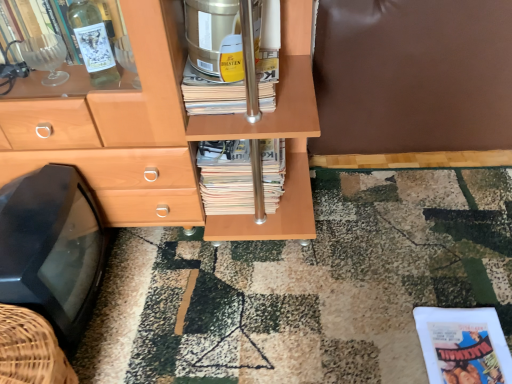
This screenshot has width=512, height=384. What are the coordinates of `black plastic tv at lower left` in the screenshot? It's located at (52, 248).

The width and height of the screenshot is (512, 384). What are the coordinates of `gold metallic canister at center` in the screenshot? It's located at (211, 94).

Identify the location of matte white paperback book at lower right. (463, 345).

This screenshot has width=512, height=384. What do you see at coordinates (463, 345) in the screenshot? I see `matte white paperback book at lower right` at bounding box center [463, 345].

At what (x,y) coordinates should I click in order to perform the action: click on stacked paper magazine at center. Please return your answer as a coordinate pair (x, y). This screenshot has width=512, height=384. Looking at the image, I should click on (226, 177).

Which object is positioned more to the right, stacked paper magazine at center or gold metallic canister at center?

From the viewer's perspective, stacked paper magazine at center appears more on the right side.

Can you confirm if stacked paper magazine at center is thinner than gold metallic canister at center?

Indeed, stacked paper magazine at center has a lesser width compared to gold metallic canister at center.

Image resolution: width=512 pixels, height=384 pixels. Find the location of `book in front of the stacked paper magazine at center`. book in front of the stacked paper magazine at center is located at coordinates (211, 94).

Which is in front, point (207, 200) or point (183, 77)?

Positioned in front is point (183, 77).

Is matte white paperback book at lower right not inside stacked paper magazine at center?

Yes.

The image size is (512, 384). Find the location of `magazine on the left of matte white paperback book at lower right`. magazine on the left of matte white paperback book at lower right is located at coordinates (226, 177).

Consider the image. From the image's perspective, is matte white paperback book at lower right positioned above or below stacked paper magazine at center?

Based on their image positions, matte white paperback book at lower right is located beneath stacked paper magazine at center.

Between matte white paperback book at lower right and stacked paper magazine at center, which one is positioned behind?

Positioned behind is stacked paper magazine at center.

Is matte white paperback book at lower right at the left side of black plastic tv at lower left?

Incorrect, matte white paperback book at lower right is not on the left side of black plastic tv at lower left.

Is matte white paperback book at lower right bigger than black plastic tv at lower left?

No.

Identify the location of paperback book on the right of black plastic tv at lower left. (463, 345).

Can you tell me how much matte white paperback book at lower right and black plastic tv at lower left differ in facing direction?

The angular difference between matte white paperback book at lower right and black plastic tv at lower left is 94.7 degrees.

Which is behind, black plastic tv at lower left or matte white paperback book at lower right?

Positioned behind is matte white paperback book at lower right.

How many degrees apart are the facing directions of black plastic tv at lower left and matte white paperback book at lower right?

The angular difference between black plastic tv at lower left and matte white paperback book at lower right is 94.7 degrees.

From the image's perspective, is black plastic tv at lower left over matte white paperback book at lower right?

Yes, from the image's perspective, black plastic tv at lower left is over matte white paperback book at lower right.

Locate an element on the screen. The image size is (512, 384). flat above the matte white paperback book at lower right (from a real-world perspective) is located at coordinates (52, 248).

In the scene shown: From the image's perspective, which one is positioned lower, gold metallic canister at center or stacked paper magazine at center?

stacked paper magazine at center is shown below in the image.

Which is more to the left, gold metallic canister at center or stacked paper magazine at center?

From the viewer's perspective, gold metallic canister at center appears more on the left side.

This screenshot has width=512, height=384. There is a stacked paper magazine at center. What are the coordinates of `book above it (from a real-world perspective)` in the screenshot? It's located at (211, 94).

Is black plastic tv at lower left turned away from stacked paper magazine at center?

No, stacked paper magazine at center is not at the back of black plastic tv at lower left.

Is black plastic tv at lower left shorter than stacked paper magazine at center?

In fact, black plastic tv at lower left may be taller than stacked paper magazine at center.

Is black plastic tv at lower left touching stacked paper magazine at center?

No, black plastic tv at lower left is not making contact with stacked paper magazine at center.

How many degrees apart are the facing directions of stacked paper magazine at center and matte white paperback book at lower right?

The angular difference between stacked paper magazine at center and matte white paperback book at lower right is 2.43 degrees.

Between stacked paper magazine at center and matte white paperback book at lower right, which one is positioned behind?

stacked paper magazine at center.

Is matte white paperback book at lower right at the back of stacked paper magazine at center?

No, stacked paper magazine at center's orientation is not away from matte white paperback book at lower right.

Between stacked paper magazine at center and matte white paperback book at lower right, which one appears on the left side from the viewer's perspective?

stacked paper magazine at center is more to the left.

The height and width of the screenshot is (384, 512). I want to click on book in front of the stacked paper magazine at center, so click(211, 94).

Find the location of a particular element. magazine that is behind the matte white paperback book at lower right is located at coordinates point(226,177).

Looking at the image, which one is located further to matte white paperback book at lower right, stacked paper magazine at center or gold metallic canister at center?

Among the two, gold metallic canister at center is located further to matte white paperback book at lower right.

When comparing their distances from stacked paper magazine at center, does matte white paperback book at lower right or black plastic tv at lower left seem closer?

black plastic tv at lower left is closer to stacked paper magazine at center.

Considering their positions, is stacked paper magazine at center positioned further to matte white paperback book at lower right than black plastic tv at lower left?

Based on the image, black plastic tv at lower left appears to be further to matte white paperback book at lower right.

From the image, which object appears to be farther from gold metallic canister at center, stacked paper magazine at center or matte white paperback book at lower right?

matte white paperback book at lower right is positioned further to the anchor gold metallic canister at center.

Looking at the image, which one is located further to stacked paper magazine at center, black plastic tv at lower left or gold metallic canister at center?

black plastic tv at lower left.

Based on their spatial positions, is black plastic tv at lower left or matte white paperback book at lower right further from gold metallic canister at center?

matte white paperback book at lower right is further to gold metallic canister at center.

Which object lies further to the anchor point gold metallic canister at center, stacked paper magazine at center or black plastic tv at lower left?

black plastic tv at lower left.

From the image, which object appears to be farther from matte white paperback book at lower right, gold metallic canister at center or black plastic tv at lower left?

black plastic tv at lower left is positioned further to the anchor matte white paperback book at lower right.

The width and height of the screenshot is (512, 384). Identify the location of book between black plastic tv at lower left and matte white paperback book at lower right in the horizontal direction. (211, 94).

Where is `magazine between gold metallic canister at center and matte white paperback book at lower right vertically`? Image resolution: width=512 pixels, height=384 pixels. magazine between gold metallic canister at center and matte white paperback book at lower right vertically is located at coordinates (226, 177).

The height and width of the screenshot is (384, 512). Find the location of `magazine situated between black plastic tv at lower left and matte white paperback book at lower right from left to right`. magazine situated between black plastic tv at lower left and matte white paperback book at lower right from left to right is located at coordinates (226, 177).

At what (x,y) coordinates should I click in order to perform the action: click on book between black plastic tv at lower left and stacked paper magazine at center. Please return your answer as a coordinate pair (x, y). The image size is (512, 384). Looking at the image, I should click on (211, 94).